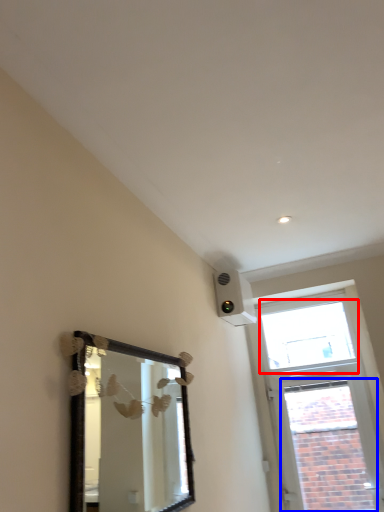
Question: Among these objects, which one is farthest to the camera, window (highlighted by a red box) or window (highlighted by a blue box)?

Choices:
 (A) window
 (B) window

Answer: (A)